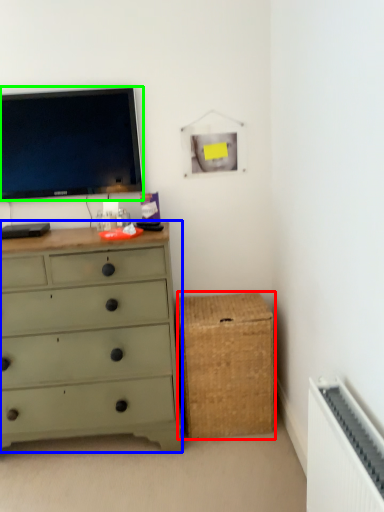
Question: Which is nearer to the storage box (highlighted by a red box)? chest of drawers (highlighted by a blue box) or television (highlighted by a green box).

Choices:
 (A) chest of drawers
 (B) television

Answer: (A)